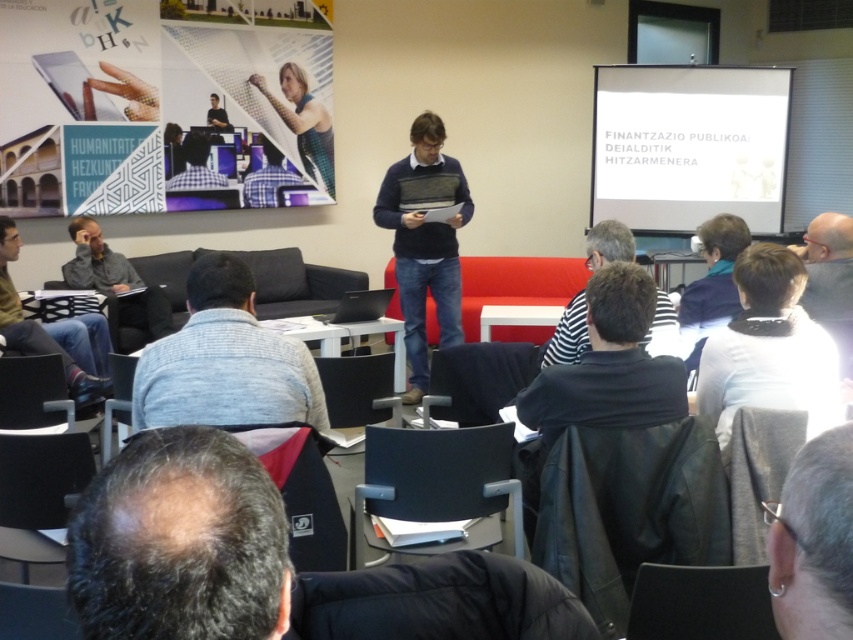
You are a photographer standing at the back of the room. You want to take a photo of the white fleece at lower right and the knitted sweater at center. Which one will appear larger in your photo?

The white fleece at lower right will appear larger in the photo because it is closer to the viewer than the knitted sweater at center.

You are an event planner observing the seminar room setup. You notice the gray hair at upper right and the matte black sweater at center. Which object is located lower in the image?

The gray hair at upper right is positioned under the matte black sweater at center, so the gray hair at upper right is located lower in the image.

You are a photographer positioned at the camera. You need to capture a closeup shot of the presenter standing in front of the red sofa. However, there is a white fleece at lower right in the way. Can you move closer to the presenter without moving the white fleece?

The white fleece at lower right is 7.34 feet away from the camera. If you move closer to the presenter, you might get closer than 7.34 feet, which could cause the white fleece to appear larger in the frame or block the presenter more. However, since the fleece is at the lower right, moving closer might not necessarily block the presenter if you adjust your angle. But strictly based on the given distance, moving closer than 7.34 feet would reduce the distance between the camera and the fleece, potentially ob